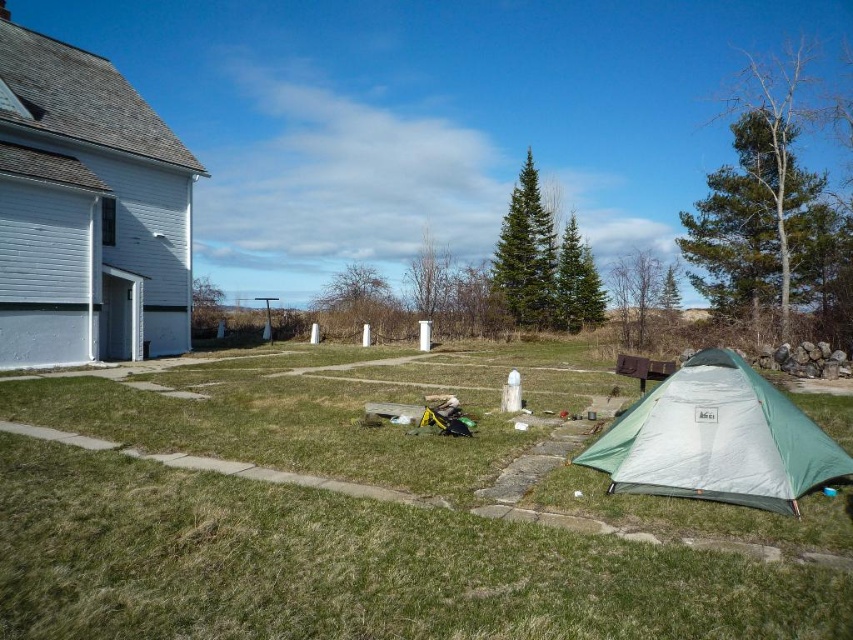
Question: Can you confirm if white painted wood house at left is wider than green fabric tent at lower right?

Choices:
 (A) no
 (B) yes

Answer: (B)

Question: Which object is the farthest from the white painted wood house at left?

Choices:
 (A) green fabric tent at lower right
 (B) green grass at lower left

Answer: (A)

Question: Does green grass at lower left appear on the left side of white painted wood house at left?

Choices:
 (A) yes
 (B) no

Answer: (B)

Question: Which object appears closest to the camera in this image?

Choices:
 (A) green grass at lower left
 (B) white painted wood house at left

Answer: (A)

Question: Can you confirm if green grass at lower left is positioned to the right of green fabric tent at lower right?

Choices:
 (A) yes
 (B) no

Answer: (B)

Question: Which object is positioned closest to the white painted wood house at left?

Choices:
 (A) green fabric tent at lower right
 (B) green grass at lower left

Answer: (B)